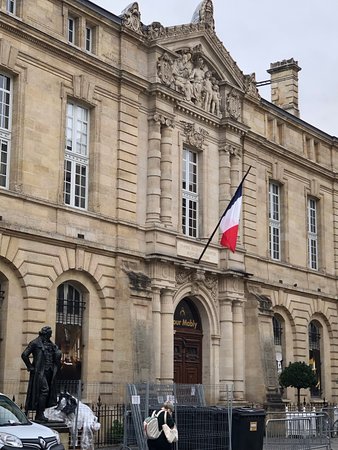
This screenshot has height=450, width=338. I want to click on window, so click(316, 357).